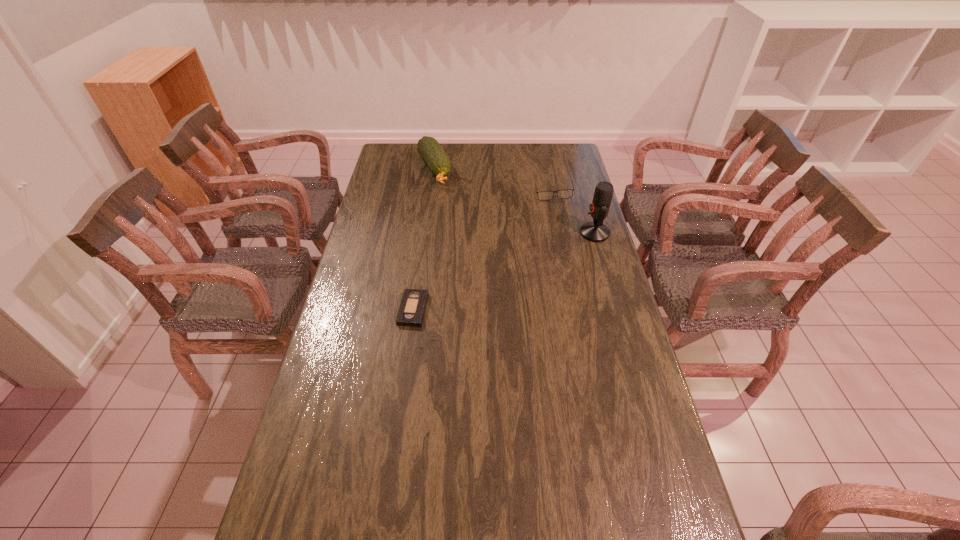
The height and width of the screenshot is (540, 960). I want to click on the shortest object, so click(x=411, y=312).

Identify the location of videotape. (411, 312).

Find the location of a particular element. The height and width of the screenshot is (540, 960). the third farthest object is located at coordinates (596, 231).

This screenshot has width=960, height=540. I want to click on microphone, so click(x=596, y=231).

Image resolution: width=960 pixels, height=540 pixels. Find the location of `the third shortest object`. the third shortest object is located at coordinates pyautogui.click(x=437, y=160).

Find the location of `the second shortest object`. the second shortest object is located at coordinates (566, 193).

Where is `vacant space located 0.060m on the back of the shortest object`? The image size is (960, 540). vacant space located 0.060m on the back of the shortest object is located at coordinates (418, 280).

Where is `free space located on the side of the tallest object with the red ring`? free space located on the side of the tallest object with the red ring is located at coordinates pyautogui.click(x=492, y=233).

Identify the location of vacant space situated on the side of the tallest object with the red ring. (490, 233).

Image resolution: width=960 pixels, height=540 pixels. Find the location of `vacant region located 0.070m on the side of the tallest object with the red ring`. vacant region located 0.070m on the side of the tallest object with the red ring is located at coordinates (562, 233).